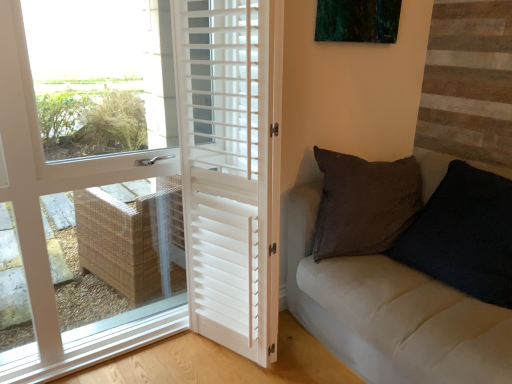
Question: Would you say velvet black pillow at right contains white matte door at left, which is counted as the first door, starting from the left?

Choices:
 (A) yes
 (B) no

Answer: (B)

Question: Is velvet black pillow at right in contact with white matte door at left, the second door in the right-to-left sequence?

Choices:
 (A) yes
 (B) no

Answer: (B)

Question: From the image's perspective, does velvet black pillow at right appear higher than white matte door at left, the second door in the right-to-left sequence?

Choices:
 (A) yes
 (B) no

Answer: (B)

Question: Does velvet black pillow at right have a lesser width compared to white matte door at left, which is counted as the first door, starting from the left?

Choices:
 (A) no
 (B) yes

Answer: (A)

Question: Does velvet black pillow at right appear on the left side of white matte door at left, which is counted as the first door, starting from the left?

Choices:
 (A) no
 (B) yes

Answer: (A)

Question: Is velvet black pillow at right positioned with its back to white matte door at left, which is counted as the first door, starting from the left?

Choices:
 (A) yes
 (B) no

Answer: (B)

Question: Are white matte shutters at center, which is the first door in right-to-left order, and white matte door at left, which is counted as the first door, starting from the left, located far from each other?

Choices:
 (A) no
 (B) yes

Answer: (A)

Question: Is white matte shutters at center, which appears as the second door when viewed from the left, outside white matte door at left, which is counted as the first door, starting from the left?

Choices:
 (A) no
 (B) yes

Answer: (B)

Question: Is white matte shutters at center, which is the first door in right-to-left order, next to white matte door at left, which is counted as the first door, starting from the left?

Choices:
 (A) yes
 (B) no

Answer: (B)

Question: From the image's perspective, does white matte shutters at center, which appears as the second door when viewed from the left, appear higher than white matte door at left, which is counted as the first door, starting from the left?

Choices:
 (A) yes
 (B) no

Answer: (B)

Question: Does white matte shutters at center, which is the first door in right-to-left order, lie behind white matte door at left, the second door in the right-to-left sequence?

Choices:
 (A) no
 (B) yes

Answer: (B)

Question: Would you say white matte door at left, the second door in the right-to-left sequence, is part of white matte shutters at center, which is the first door in right-to-left order,'s contents?

Choices:
 (A) yes
 (B) no

Answer: (B)

Question: Is white matte door at left, which is counted as the first door, starting from the left, positioned far away from white matte shutters at center, which is the first door in right-to-left order?

Choices:
 (A) no
 (B) yes

Answer: (A)